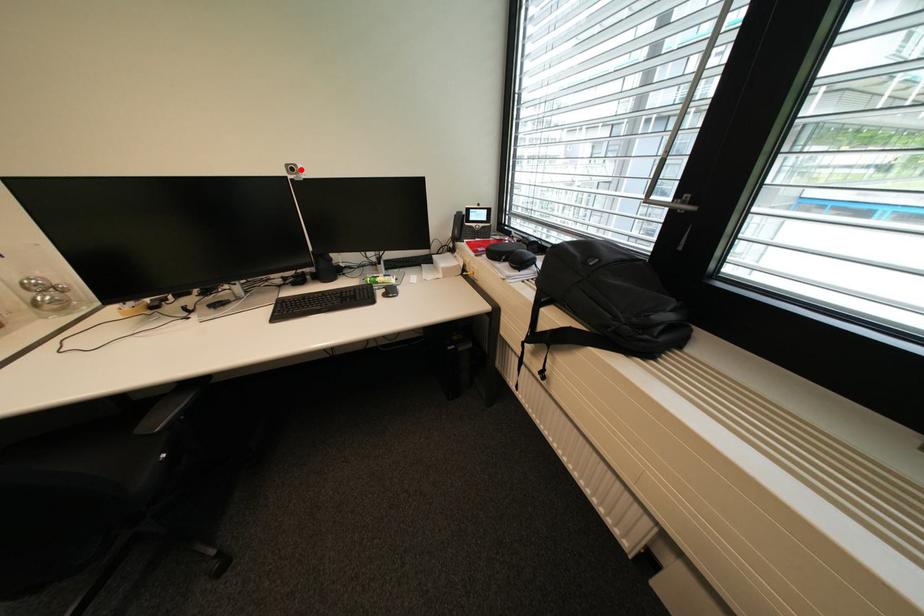
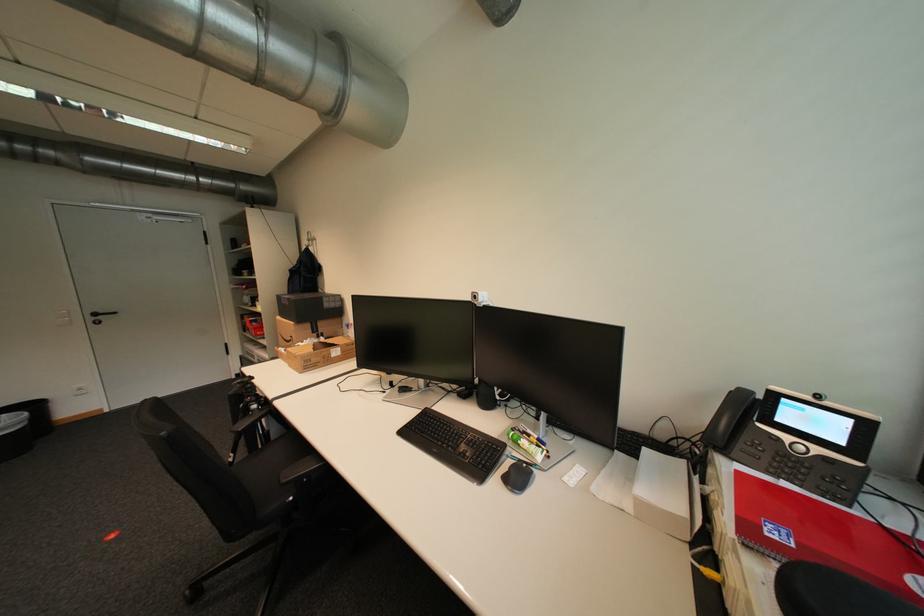
The point at the highlighted location is marked in the first image. Where is the corresponding point in the second image?

(483, 297)